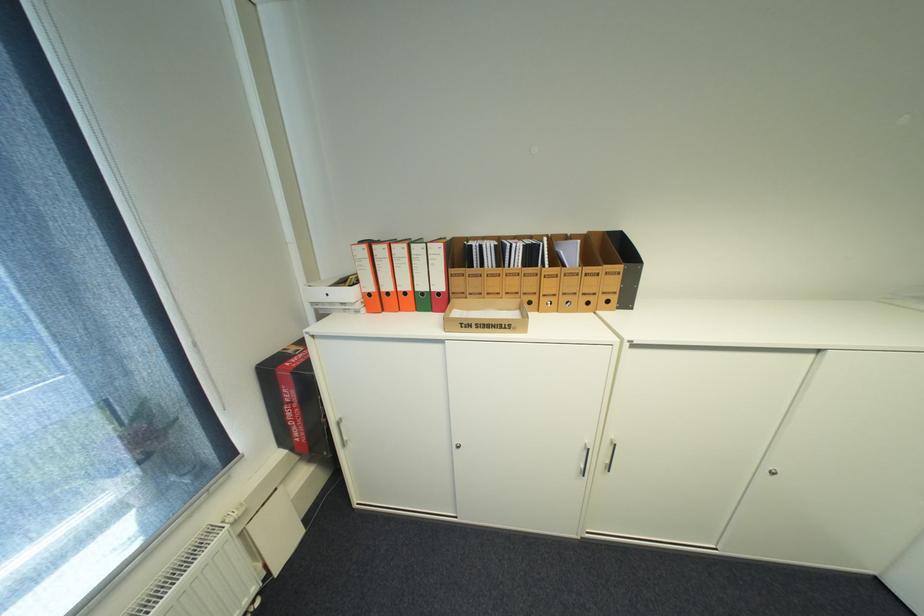
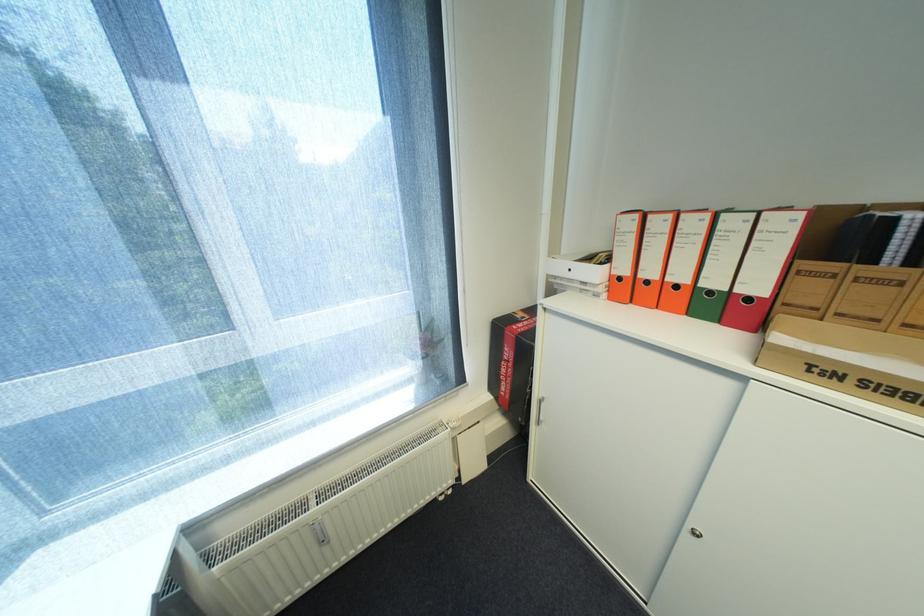
The point at (463,447) is marked in the first image. Where is the corresponding point in the second image?

(697, 528)